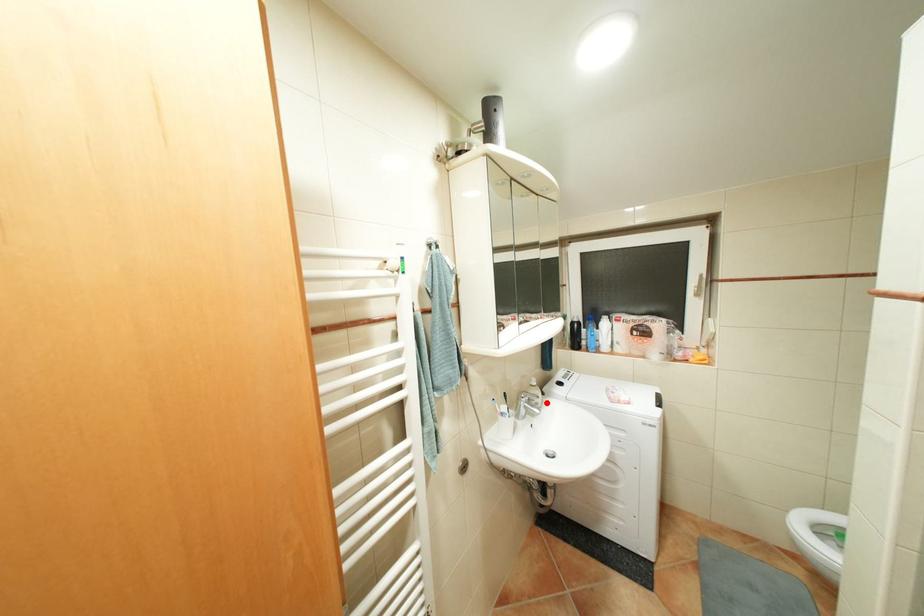
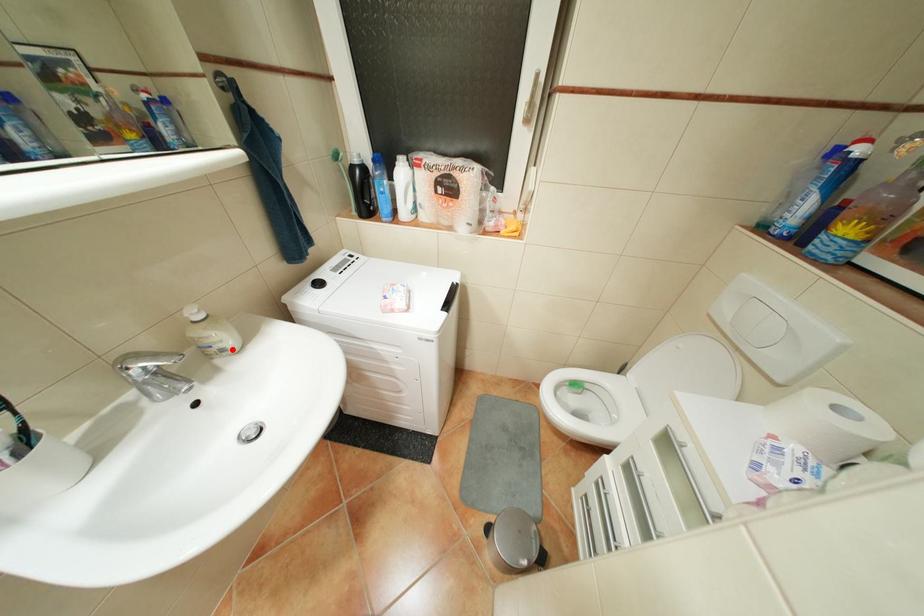
I am providing you with two images of the same scene from different viewpoints. A red point is marked on the first image and another point is marked on the second image. Is the marked point in image1 the same physical position as the marked point in image2?

Yes